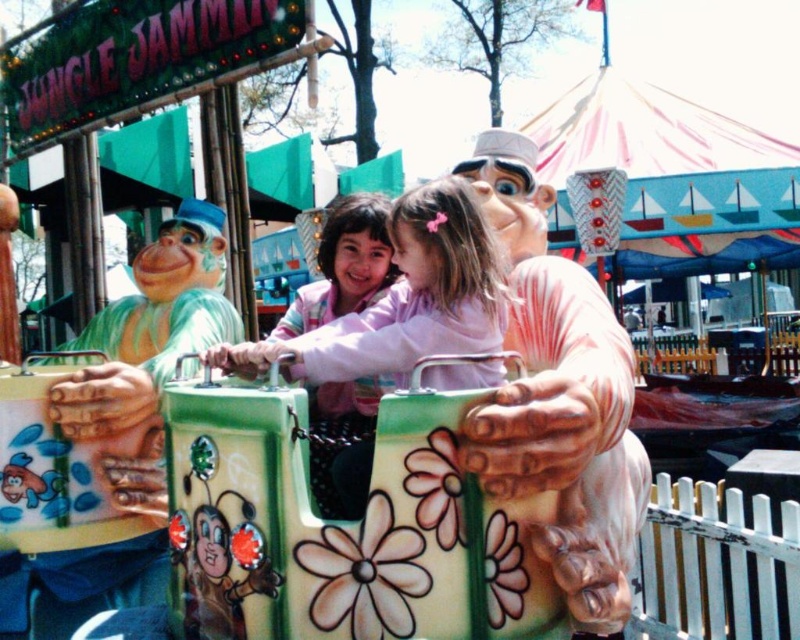
Question: Can you confirm if matte pink plush monkey at center is wider than pink matte jacket at center?

Choices:
 (A) no
 (B) yes

Answer: (A)

Question: Which of the following is the closest to the observer?

Choices:
 (A) pink matte jacket at center
 (B) matte pink plush monkey at center

Answer: (B)

Question: Can you confirm if matte pink plush monkey at center is thinner than pink matte jacket at center?

Choices:
 (A) yes
 (B) no

Answer: (A)

Question: Can you confirm if matte pink plush monkey at center is positioned to the left of pink matte jacket at center?

Choices:
 (A) yes
 (B) no

Answer: (B)